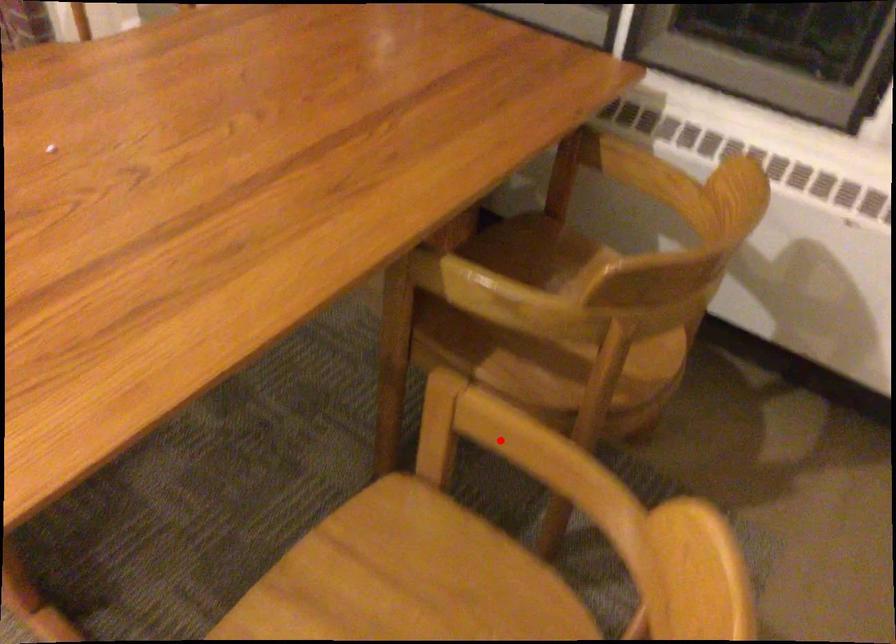
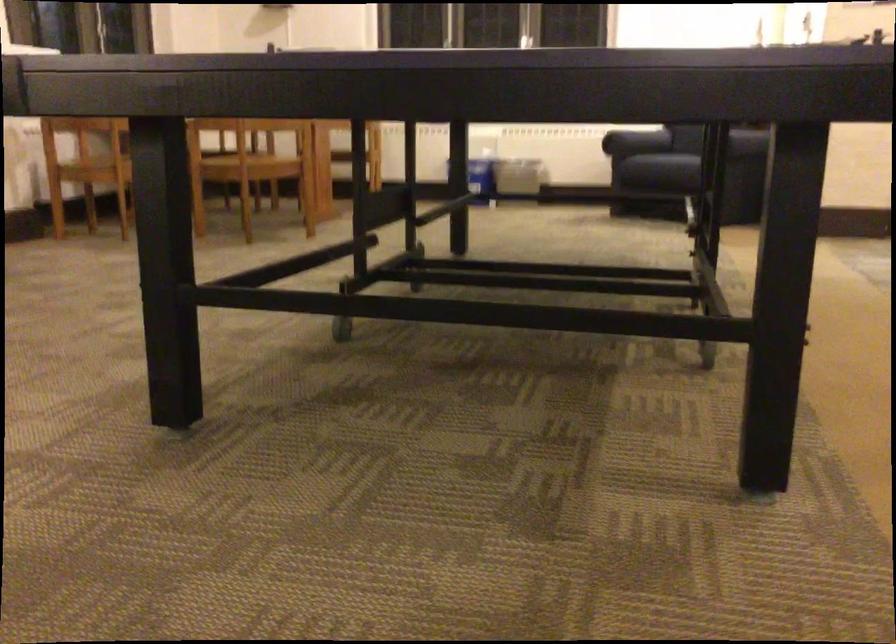
Question: I am providing you with two images of the same scene from different viewpoints. A red point is marked on the first image. Can you still see the location of the red point in image 2?

Choices:
 (A) Yes
 (B) No

Answer: (B)